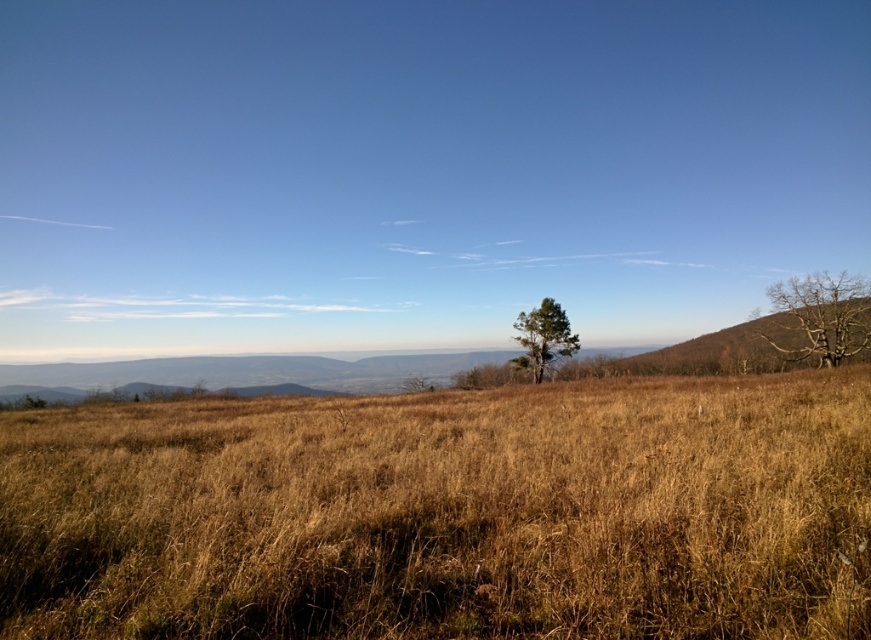
Question: Can you confirm if dry grass at center is smaller than bare wood tree at right?

Choices:
 (A) yes
 (B) no

Answer: (A)

Question: Can you confirm if dry grass at center is positioned above bare wood tree at right?

Choices:
 (A) yes
 (B) no

Answer: (B)

Question: Considering the relative positions of bare wood tree at right and green matte tree at center in the image provided, where is bare wood tree at right located with respect to green matte tree at center?

Choices:
 (A) left
 (B) right

Answer: (B)

Question: Which of the following is the closest to the observer?

Choices:
 (A) (443, 547)
 (B) (836, 330)

Answer: (A)

Question: Which object is positioned closest to the dry grass at center?

Choices:
 (A) green matte tree at center
 (B) bare wood tree at right

Answer: (B)

Question: Which object is closer to the camera taking this photo?

Choices:
 (A) green matte tree at center
 (B) dry grass at center

Answer: (B)